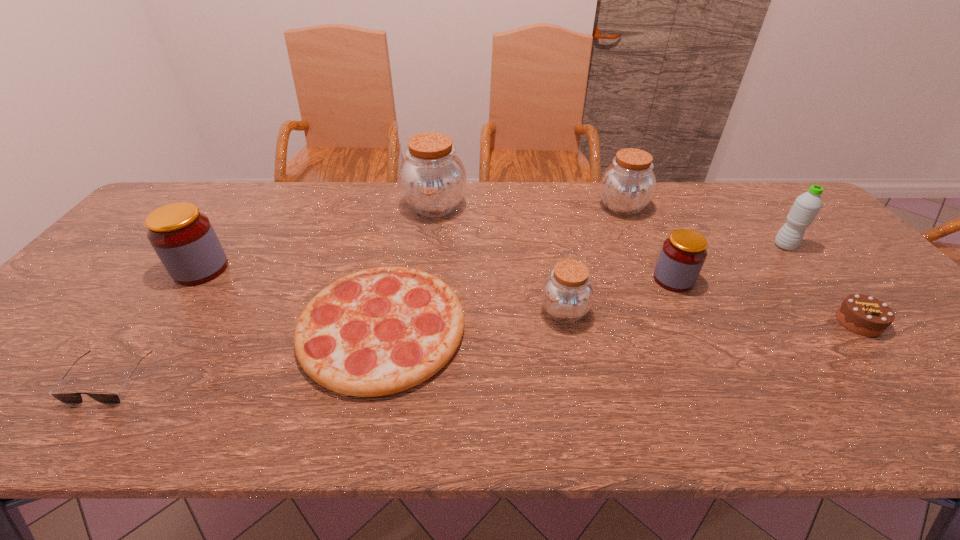
Find the location of a particular element. The width and height of the screenshot is (960, 540). the biggest brown jar is located at coordinates (432, 178).

Locate an element on the screen. The height and width of the screenshot is (540, 960). the leftmost brown jar is located at coordinates (432, 178).

Find the location of `water bottle`. water bottle is located at coordinates (806, 206).

Image resolution: width=960 pixels, height=540 pixels. What are the coordinates of `the third farthest object` in the screenshot? It's located at (806, 206).

Locate an element on the screen. This screenshot has height=540, width=960. the rightmost brown jar is located at coordinates (627, 186).

I want to click on the leftmost jar, so coord(183,238).

The width and height of the screenshot is (960, 540). What are the coordinates of `the bigger red jar` in the screenshot? It's located at (183, 238).

At what (x,y) coordinates should I click in order to perform the action: click on the right red jar. Please return your answer as a coordinate pair (x, y). Image resolution: width=960 pixels, height=540 pixels. Looking at the image, I should click on (682, 256).

Find the location of `the nearest brown jar`. the nearest brown jar is located at coordinates (567, 294).

Identify the location of the smallest brown jar. The image size is (960, 540). (567, 294).